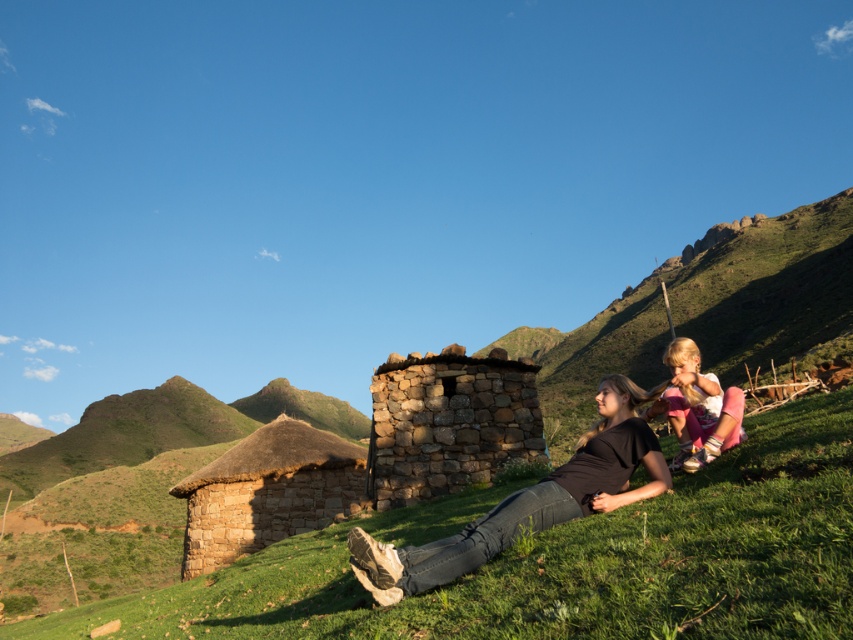
Question: Which is farther from the green grassy at lower center?

Choices:
 (A) light pink fabric at lower right
 (B) black matte shirt at center

Answer: (A)

Question: Which of the following is the farthest from the observer?

Choices:
 (A) black matte shirt at center
 (B) light pink fabric at lower right
 (C) thatched straw hut at center
 (D) green grassy at lower center

Answer: (C)

Question: Can you confirm if thatched straw hut at center is positioned to the right of light pink fabric at lower right?

Choices:
 (A) no
 (B) yes

Answer: (A)

Question: Is green grassy at lower center smaller than light pink fabric at lower right?

Choices:
 (A) no
 (B) yes

Answer: (A)

Question: Which of the following is the farthest from the observer?

Choices:
 (A) green grassy at lower center
 (B) black matte shirt at center
 (C) light pink fabric at lower right
 (D) thatched straw hut at center

Answer: (D)

Question: Is black matte shirt at center closer to the viewer compared to light pink fabric at lower right?

Choices:
 (A) no
 (B) yes

Answer: (B)